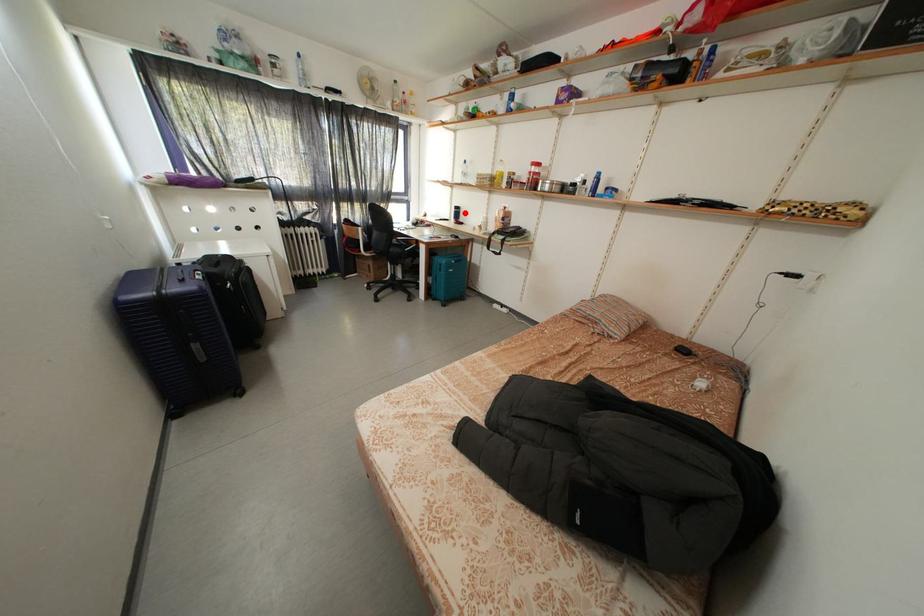
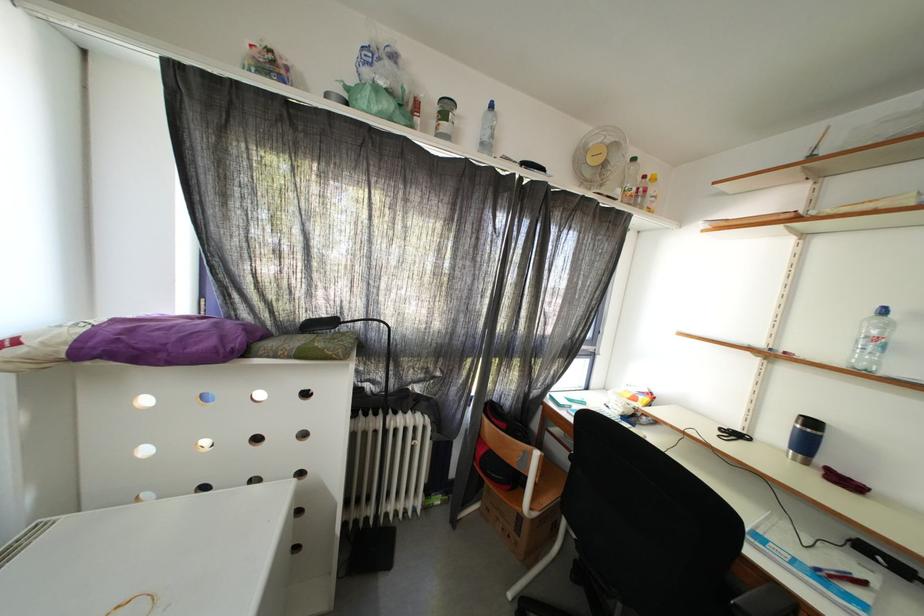
Question: I am providing you with two images of the same scene from different viewpoints. In image1, a red point is highlighted. Considering the same 3D point in image2, which of the following is correct?

Choices:
 (A) It is closer
 (B) It is farther

Answer: (B)